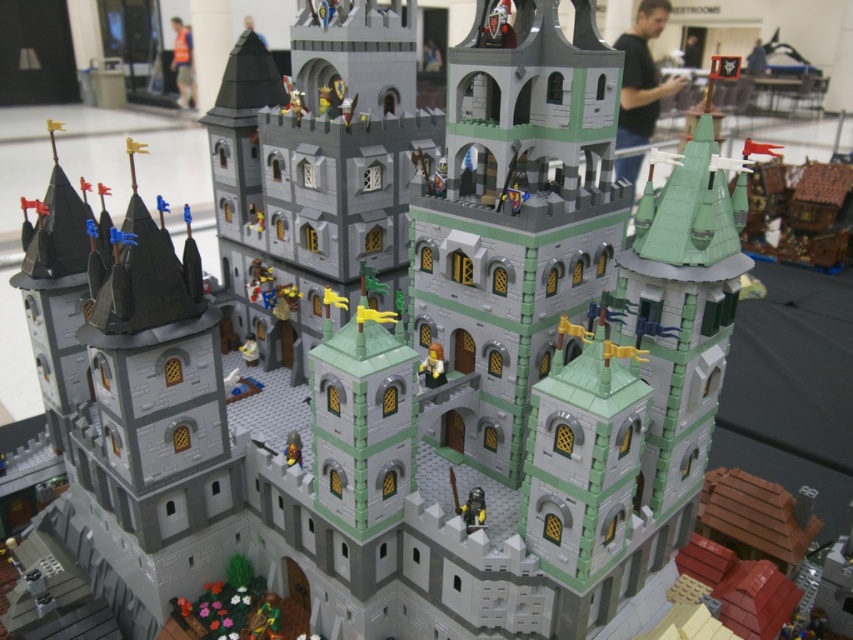
You are a LEGO architect trying to place a new flagpole on the tallest LEGO minifigure in the scene. Which minifigure should you choose between the shiny metallic knight at lower center and the light brown plastic minifigure at center?

The light brown plastic minifigure at center is taller than the shiny metallic knight at lower center, so you should place the flagpole on the light brown plastic minifigure at center.

In the LEGO castle model, where is the shiny metallic knight at lower center located in terms of coordinates?

The shiny metallic knight at lower center is located at point coordinates of [473,509].